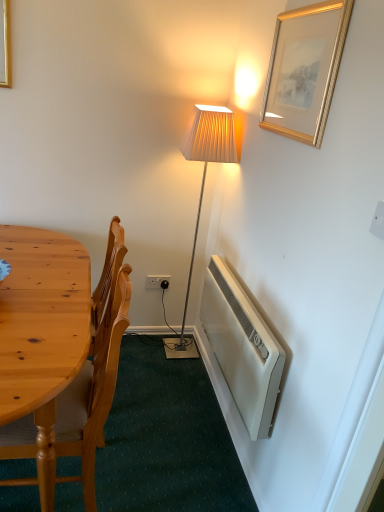
Where is `free point behind wooden chair at left`? This screenshot has height=512, width=384. free point behind wooden chair at left is located at coordinates (139, 413).